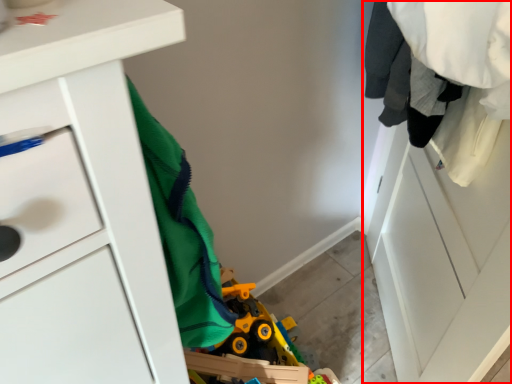
Question: From the image's perspective, what is the correct spatial relationship of closet (annotated by the red box) in relation to chest of drawers?

Choices:
 (A) below
 (B) above

Answer: (A)